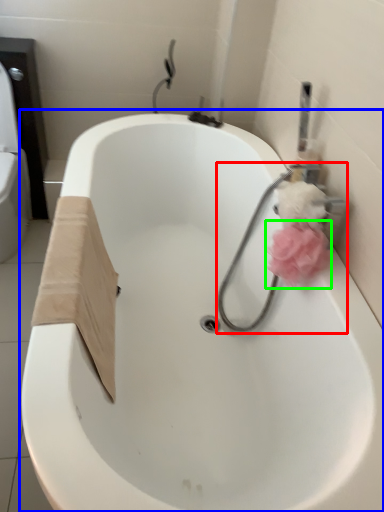
Question: Which object is the farthest from plumbing fixture (highlighted by a red box)? Choose among these: bathtub (highlighted by a blue box) or flower (highlighted by a green box).

Choices:
 (A) bathtub
 (B) flower

Answer: (A)